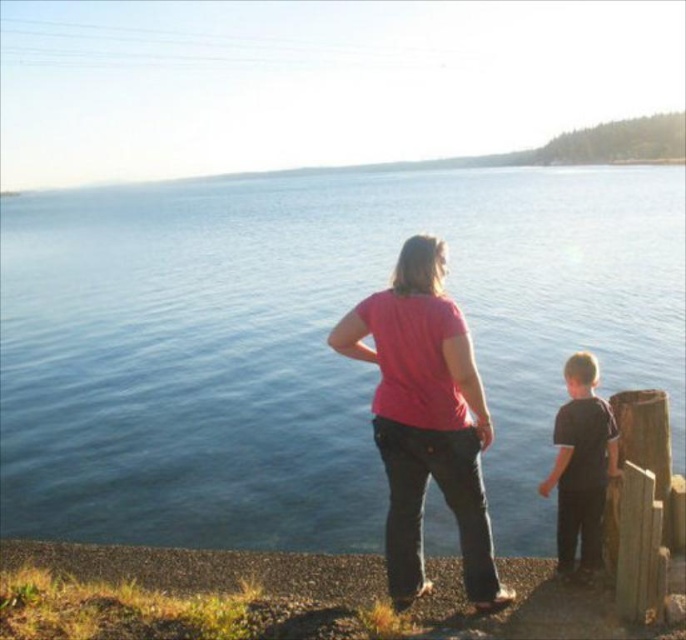
Based on the scene description, where is the blue water at center located in terms of coordinates?

The blue water at center is located at coordinates point (307, 342).

You are a photographer trying to capture a shot of the blue water at center and the dark brown fabric shirt at right. Which object should you focus on first if you want to ensure both are in the frame without moving the camera?

The blue water at center is above the dark brown fabric shirt at right, so you should focus on the dark brown fabric shirt at right first to ensure both are in the frame without moving the camera.